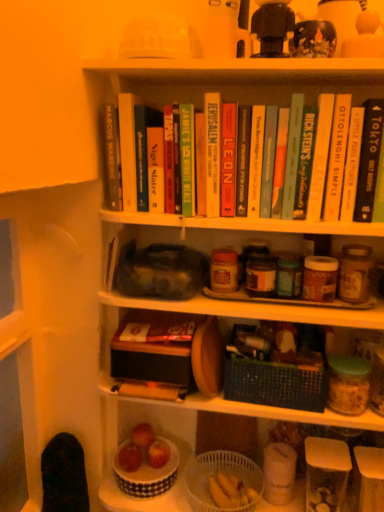
Question: Which direction should I rotate to look at black woven basket at center, marked as the second basket in a bottom-to-top arrangement?

Choices:
 (A) right
 (B) left

Answer: (A)

Question: Does white textured bowl at lower center have a lesser width compared to hardcover book at upper right, positioned as the 1th paperback book in right-to-left order?

Choices:
 (A) yes
 (B) no

Answer: (B)

Question: Is white textured bowl at lower center surrounding hardcover book at upper right, positioned as the 1th paperback book in right-to-left order?

Choices:
 (A) yes
 (B) no

Answer: (B)

Question: Is white textured bowl at lower center taller than hardcover book at upper right, marked as the thirteenth paperback book in a left-to-right arrangement?

Choices:
 (A) no
 (B) yes

Answer: (A)

Question: Is white textured bowl at lower center next to hardcover book at upper right, marked as the thirteenth paperback book in a left-to-right arrangement, and touching it?

Choices:
 (A) no
 (B) yes

Answer: (A)

Question: Does white textured bowl at lower center have a greater width compared to hardcover book at upper right, marked as the thirteenth paperback book in a left-to-right arrangement?

Choices:
 (A) yes
 (B) no

Answer: (A)

Question: Is white textured bowl at lower center smaller than hardcover book at upper right, positioned as the 1th paperback book in right-to-left order?

Choices:
 (A) no
 (B) yes

Answer: (A)

Question: Considering the relative sizes of black plastic toy at upper center, which ranks as the second toy in right-to-left order, and white plastic basket at lower center, marked as the 1th shelf in a bottom-to-top arrangement, in the image provided, is black plastic toy at upper center, which ranks as the second toy in right-to-left order, shorter than white plastic basket at lower center, marked as the 1th shelf in a bottom-to-top arrangement,?

Choices:
 (A) no
 (B) yes

Answer: (A)

Question: Considering the relative sizes of black plastic toy at upper center, which ranks as the second toy in right-to-left order, and white plastic basket at lower center, the third shelf when ordered from top to bottom, in the image provided, is black plastic toy at upper center, which ranks as the second toy in right-to-left order, thinner than white plastic basket at lower center, the third shelf when ordered from top to bottom,?

Choices:
 (A) yes
 (B) no

Answer: (A)

Question: Does black plastic toy at upper center, the first toy positioned from the left, come behind white plastic basket at lower center, marked as the 1th shelf in a bottom-to-top arrangement?

Choices:
 (A) yes
 (B) no

Answer: (B)

Question: Would you say black plastic toy at upper center, the first toy positioned from the left, contains white plastic basket at lower center, the third shelf when ordered from top to bottom?

Choices:
 (A) no
 (B) yes

Answer: (A)

Question: Are black plastic toy at upper center, the first toy positioned from the left, and white plastic basket at lower center, the third shelf when ordered from top to bottom, beside each other?

Choices:
 (A) yes
 (B) no

Answer: (B)

Question: From a real-world perspective, is black plastic toy at upper center, the first toy positioned from the left, beneath white plastic basket at lower center, marked as the 1th shelf in a bottom-to-top arrangement?

Choices:
 (A) yes
 (B) no

Answer: (B)

Question: Is the position of hardcover book at center, the 8th paperback book viewed from the right, more distant than that of hardcover book at upper center, the 7th paperback book from the right?

Choices:
 (A) no
 (B) yes

Answer: (A)